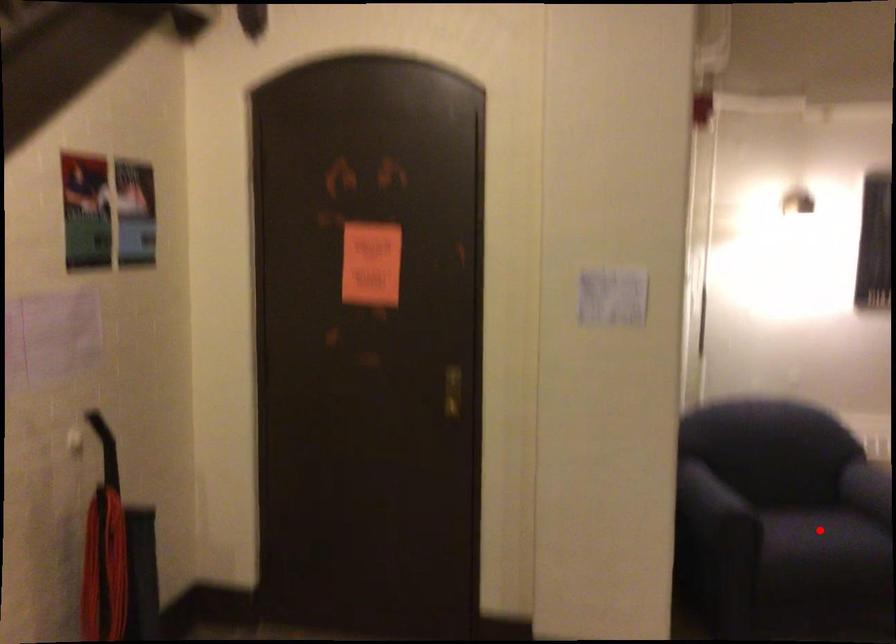
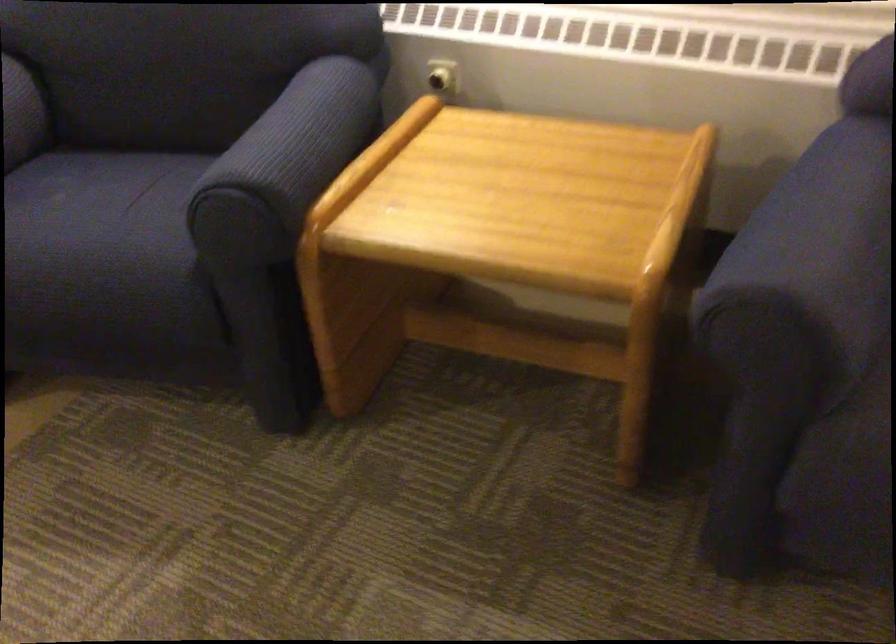
Question: I am providing you with two images of the same scene from different viewpoints. Given a red point in image1, look at the same physical point in image2. Is it:

Choices:
 (A) Closer to the viewpoint
 (B) Farther from the viewpoint

Answer: (A)